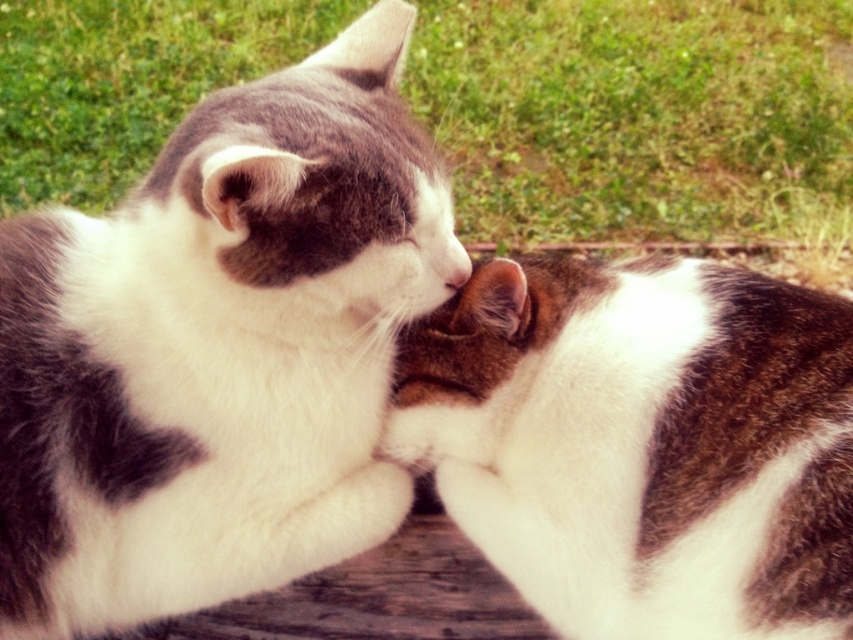
Question: From the image, what is the correct spatial relationship of white-furred cat at center in relation to matte white nose at center?

Choices:
 (A) left
 (B) right

Answer: (A)

Question: Which of the following is the closest to the observer?

Choices:
 (A) (469, 269)
 (B) (311, 456)

Answer: (A)

Question: Does white-furred cat at center have a smaller size compared to white fur cat at center?

Choices:
 (A) yes
 (B) no

Answer: (B)

Question: Is white-furred cat at center smaller than white fur cat at center?

Choices:
 (A) yes
 (B) no

Answer: (B)

Question: Which point is closer to the camera?

Choices:
 (A) (152, 548)
 (B) (785, 381)
 (C) (462, 252)

Answer: (B)

Question: Which point is farther to the camera?

Choices:
 (A) matte white nose at center
 (B) white fur cat at center
 (C) white-furred cat at center

Answer: (A)